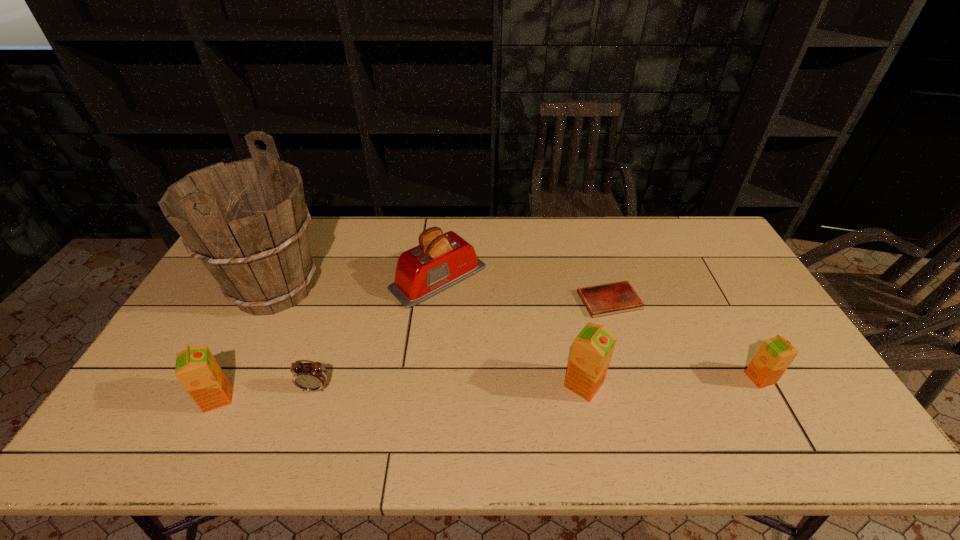
Locate an element on the screen. free location located on the back of the second orange juice from left to right is located at coordinates (574, 336).

Identify the location of vacant space situated on the left of the rightmost object. (660, 378).

What are the coordinates of `blank area located 0.230m on the front of the shortest object` in the screenshot? It's located at pyautogui.click(x=636, y=384).

The image size is (960, 540). I want to click on free space located on the back of the bucket, so click(311, 217).

Where is `free location located 0.130m on the front of the toaster`? The height and width of the screenshot is (540, 960). free location located 0.130m on the front of the toaster is located at coordinates (431, 343).

At what (x,y) coordinates should I click in order to perform the action: click on vacant area located on the face of the third object from left to right. Please return your answer as a coordinate pair (x, y). This screenshot has width=960, height=540. Looking at the image, I should click on (307, 411).

Identify the location of bucket that is at the far edge. This screenshot has width=960, height=540. (247, 221).

Where is `toaster located at the far edge`? The width and height of the screenshot is (960, 540). toaster located at the far edge is located at coordinates click(440, 261).

Identify the location of alarm clock that is at the near edge. The height and width of the screenshot is (540, 960). (312, 376).

Where is `object situated at the left edge`? object situated at the left edge is located at coordinates (247, 221).